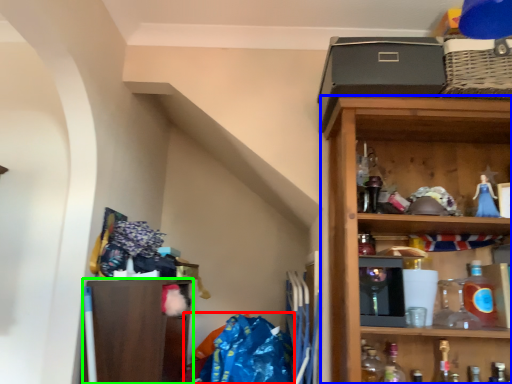
Question: Which is nearer to the material (highlighted by a red box)? shelf (highlighted by a blue box) or shelf (highlighted by a green box).

Choices:
 (A) shelf
 (B) shelf

Answer: (B)